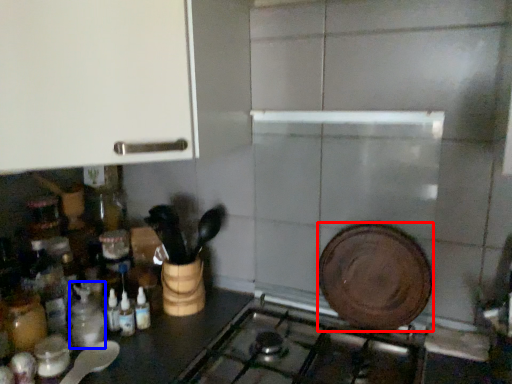
Question: Which point is further to the camera, kitchen appliance (highlighted by a red box) or bottle (highlighted by a blue box)?

Choices:
 (A) kitchen appliance
 (B) bottle

Answer: (B)